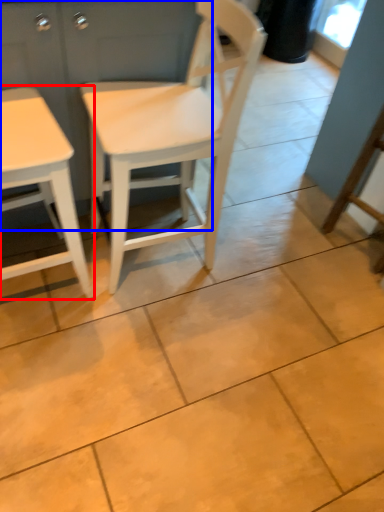
Question: Which object is further to the camera taking this photo, table (highlighted by a red box) or dresser (highlighted by a blue box)?

Choices:
 (A) table
 (B) dresser

Answer: (B)